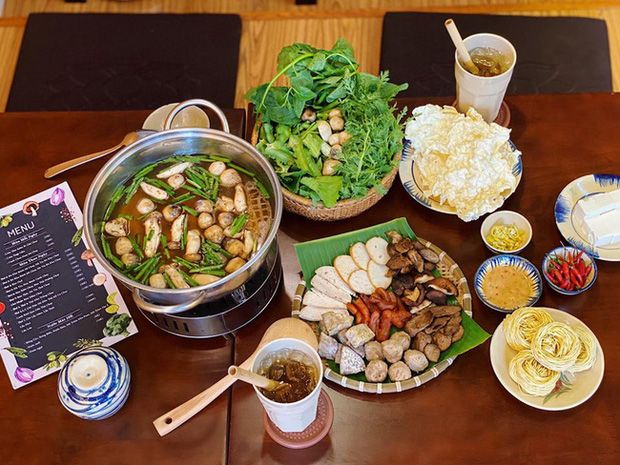
Where is `light colored wood`? Image resolution: width=620 pixels, height=465 pixels. light colored wood is located at coordinates (248, 62).